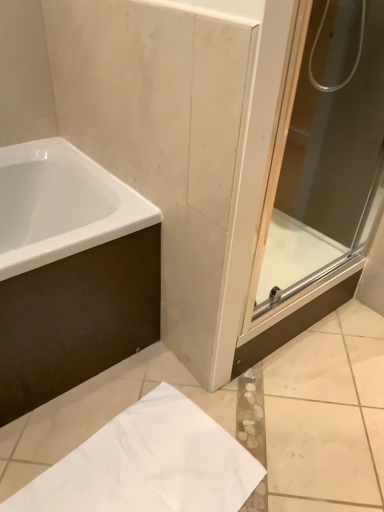
Question: Is transparent glass shower door at right completely or partially outside of white matte paper at lower center?

Choices:
 (A) yes
 (B) no

Answer: (A)

Question: From a real-world perspective, is transparent glass shower door at right on white matte paper at lower center?

Choices:
 (A) yes
 (B) no

Answer: (A)

Question: Is transparent glass shower door at right positioned behind white matte paper at lower center?

Choices:
 (A) yes
 (B) no

Answer: (B)

Question: Does transparent glass shower door at right have a lesser height compared to white matte paper at lower center?

Choices:
 (A) no
 (B) yes

Answer: (A)

Question: Can you confirm if transparent glass shower door at right is taller than white matte paper at lower center?

Choices:
 (A) yes
 (B) no

Answer: (A)

Question: From a real-world perspective, is transparent glass shower door at right above or below white matte paper at lower center?

Choices:
 (A) below
 (B) above

Answer: (B)

Question: Is transparent glass shower door at right spatially inside white matte paper at lower center, or outside of it?

Choices:
 (A) inside
 (B) outside

Answer: (B)

Question: Considering the positions of point (276, 317) and point (180, 471), is point (276, 317) closer or farther from the camera than point (180, 471)?

Choices:
 (A) farther
 (B) closer

Answer: (A)

Question: Considering the positions of transparent glass shower door at right and white matte paper at lower center in the image, is transparent glass shower door at right bigger or smaller than white matte paper at lower center?

Choices:
 (A) small
 (B) big

Answer: (B)

Question: From a real-world perspective, is white matte paper at lower center positioned above or below white glossy bathtub at upper left?

Choices:
 (A) above
 (B) below

Answer: (B)

Question: From the image's perspective, relative to white glossy bathtub at upper left, is white matte paper at lower center above or below?

Choices:
 (A) above
 (B) below

Answer: (B)

Question: Is white matte paper at lower center spatially inside white glossy bathtub at upper left, or outside of it?

Choices:
 (A) inside
 (B) outside

Answer: (B)

Question: In the image, is white matte paper at lower center positioned in front of or behind white glossy bathtub at upper left?

Choices:
 (A) front
 (B) behind

Answer: (A)

Question: Is transparent glass shower door at right wider or thinner than white glossy bathtub at upper left?

Choices:
 (A) thin
 (B) wide

Answer: (A)

Question: In terms of height, does transparent glass shower door at right look taller or shorter compared to white glossy bathtub at upper left?

Choices:
 (A) short
 (B) tall

Answer: (B)